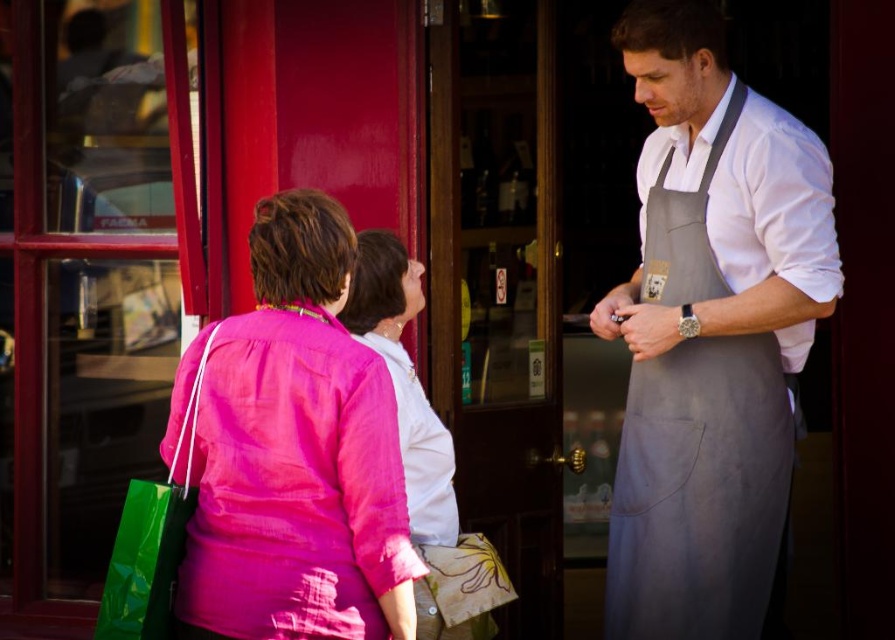
Question: Estimate the real-world distances between objects in this image. Which object is closer to the pink fabric shirt at center?

Choices:
 (A) pink fabric blouse at center
 (B) gray fabric apron at center

Answer: (A)

Question: Among these objects, which one is farthest from the camera?

Choices:
 (A) pink fabric shirt at center
 (B) gray fabric apron at center

Answer: (B)

Question: From the image, what is the correct spatial relationship of pink fabric shirt at center in relation to pink fabric blouse at center?

Choices:
 (A) above
 (B) below

Answer: (A)

Question: Which object appears closest to the camera in this image?

Choices:
 (A) pink fabric shirt at center
 (B) gray fabric apron at center

Answer: (A)

Question: Is gray fabric apron at center to the left of pink fabric shirt at center from the viewer's perspective?

Choices:
 (A) no
 (B) yes

Answer: (A)

Question: Is gray fabric apron at center positioned before pink fabric blouse at center?

Choices:
 (A) yes
 (B) no

Answer: (A)